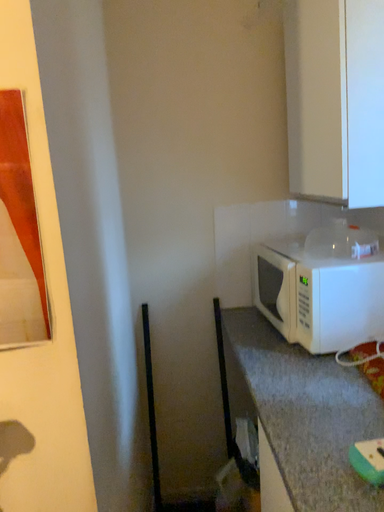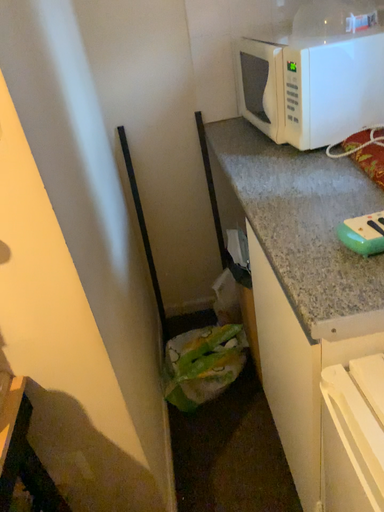
Question: Which way did the camera rotate in the video?

Choices:
 (A) rotated downward
 (B) rotated upward

Answer: (A)